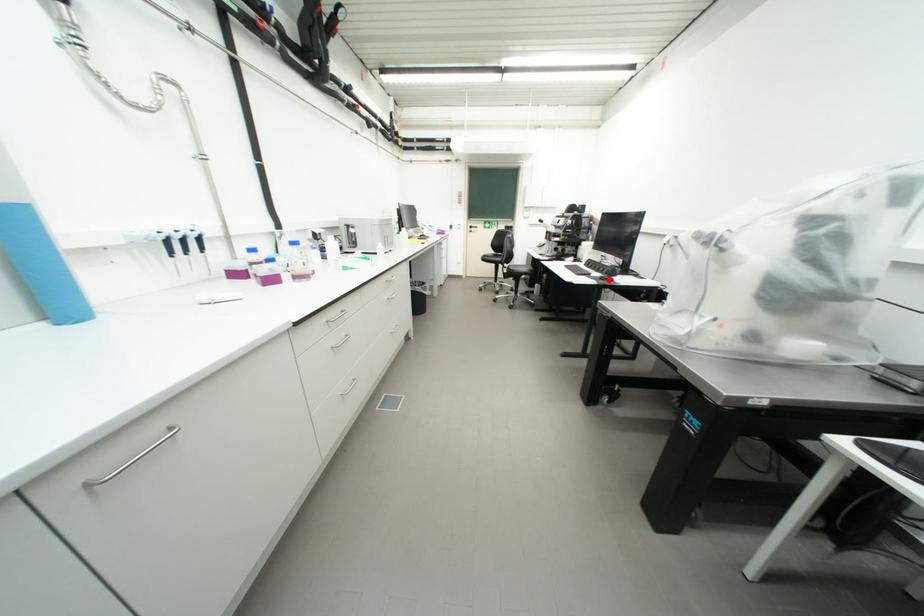
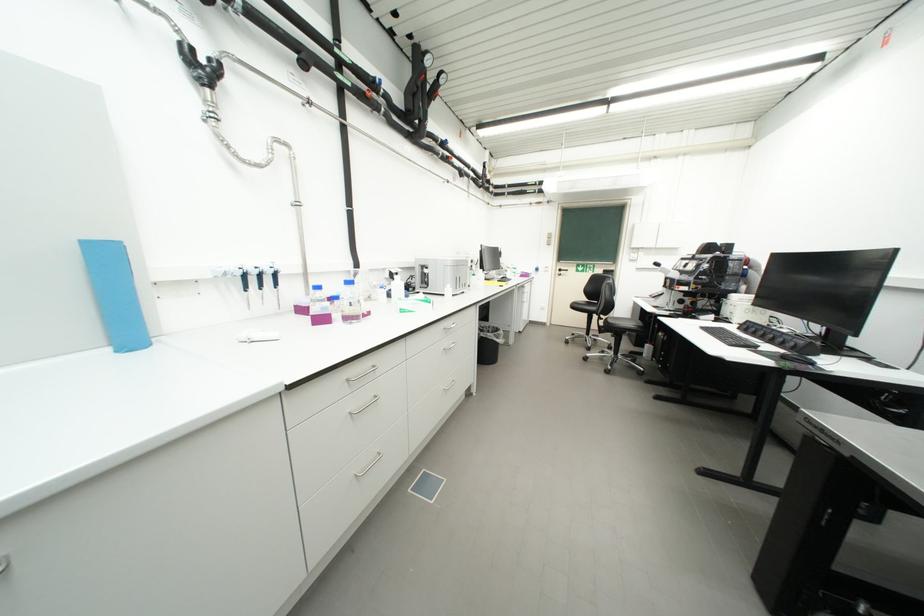
In the second image, find the point that corresponds to the highlighted location in the first image.

(792, 359)